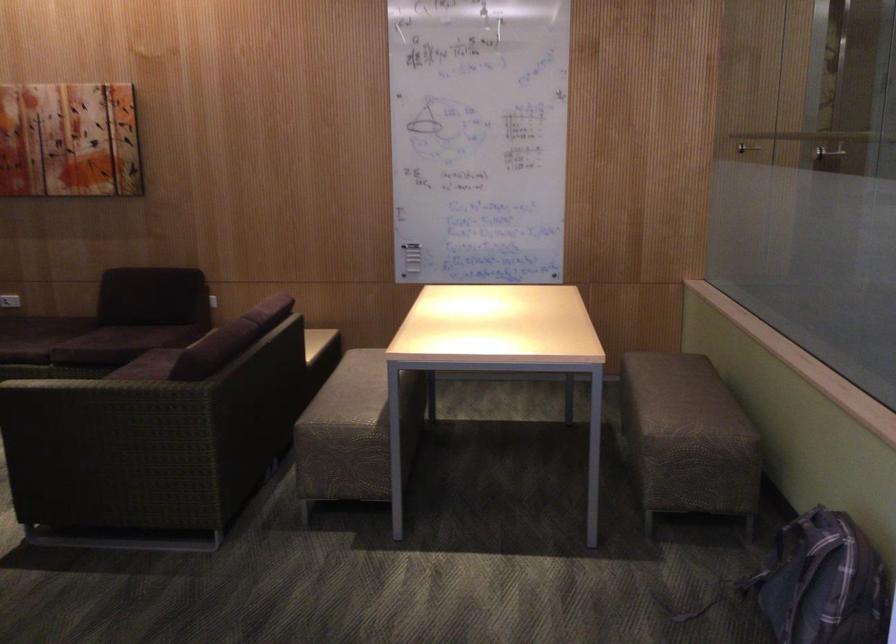
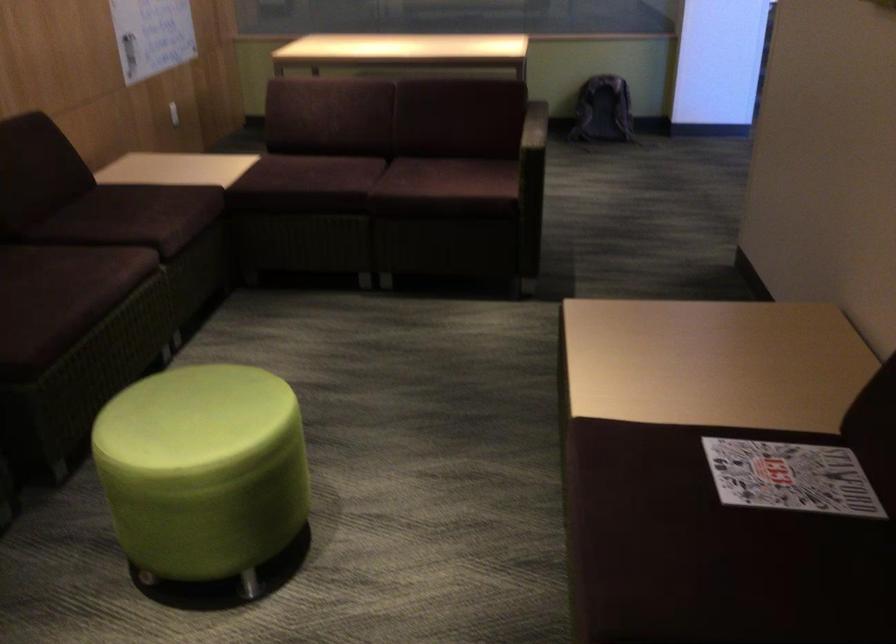
The point at (93,335) is marked in the first image. Where is the corresponding point in the second image?

(147, 214)